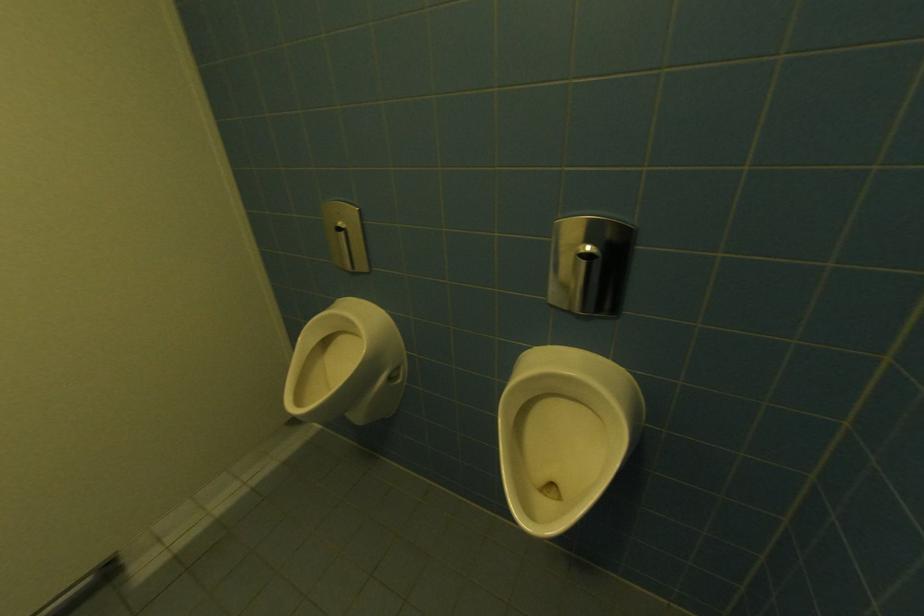
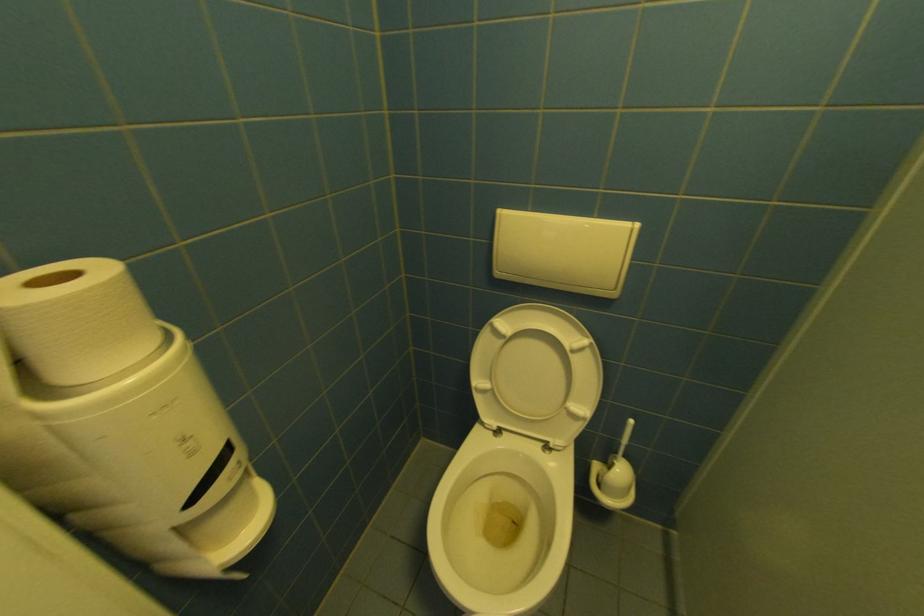
Which direction would the cameraman need to move to produce the second image?

The cameraman moved toward left, forward.